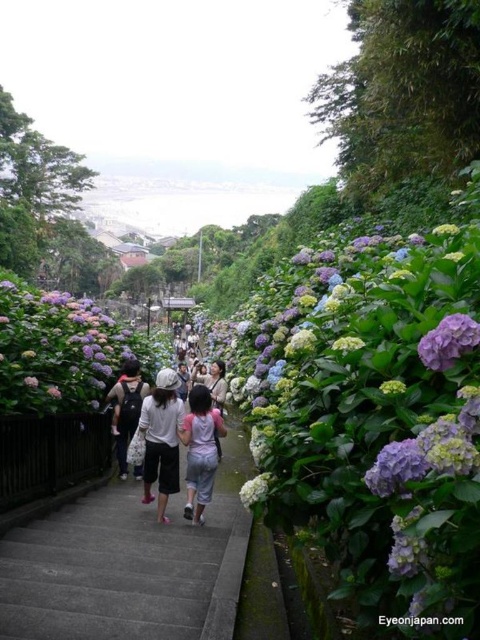
Is purple matte hydrangea at center-right above light gray cotton shirt at center?

Yes, purple matte hydrangea at center-right is above light gray cotton shirt at center.

Which is below, purple matte hydrangea at center-right or light gray cotton shirt at center?

Positioned lower is light gray cotton shirt at center.

Is point (344, 508) positioned before point (127, 388)?

Yes, point (344, 508) is in front of point (127, 388).

At what (x,y) coordinates should I click in order to perform the action: click on purple matte hydrangea at center-right. Please return your answer as a coordinate pair (x, y). The width and height of the screenshot is (480, 640). Looking at the image, I should click on (369, 419).

What do you see at coordinates (162, 440) in the screenshot? I see `white cotton shirt at center` at bounding box center [162, 440].

Which is in front, point (181, 412) or point (448, 344)?

Point (448, 344) is in front.

Where is `white cotton shirt at center`? white cotton shirt at center is located at coordinates (162, 440).

Is point (173, 413) positioned after point (134, 394)?

No.

Can you confirm if white cotton shirt at center is thinner than light gray cotton shirt at center?

Incorrect, white cotton shirt at center's width is not less than light gray cotton shirt at center's.

Which is in front, point (147, 470) or point (132, 358)?

Point (147, 470) is in front.

This screenshot has width=480, height=640. Find the location of `white cotton shirt at center`. white cotton shirt at center is located at coordinates (162, 440).